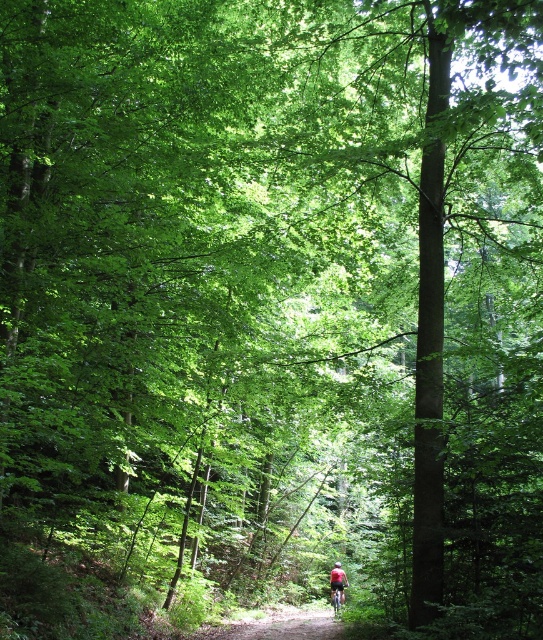
Question: In this image, where is red fabric mountain biker at center located relative to shiny metallic bicycle at center?

Choices:
 (A) right
 (B) left

Answer: (A)

Question: Among these objects, which one is nearest to the camera?

Choices:
 (A) shiny metallic bicycle at center
 (B) red fabric cyclist at center
 (C) dirt path at center

Answer: (C)

Question: Which object is the closest to the shiny metallic bicycle at center?

Choices:
 (A) red fabric mountain biker at center
 (B) dirt path at center
 (C) red fabric cyclist at center

Answer: (C)

Question: Which of the following is the farthest from the observer?

Choices:
 (A) 235,636
 (B) 339,584
 (C) 330,582
 (D) 344,600

Answer: (C)

Question: Considering the relative positions of red fabric mountain biker at center and red fabric cyclist at center in the image provided, where is red fabric mountain biker at center located with respect to red fabric cyclist at center?

Choices:
 (A) above
 (B) below

Answer: (A)

Question: Is red fabric mountain biker at center wider than shiny metallic bicycle at center?

Choices:
 (A) no
 (B) yes

Answer: (B)